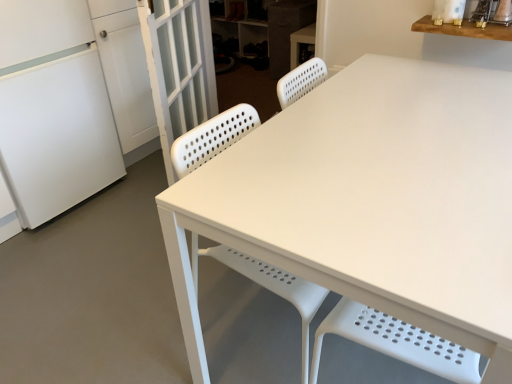
You are a GUI agent. You are given a task and a screenshot of the screen. Output one action in this format:
    pyautogui.click(x=<x>, y=<y>)
    Task: Click on the vacant space underneath white perforated plastic chair at center (from a real-world perspective)
    
    Given the screenshot: What is the action you would take?
    pyautogui.click(x=264, y=331)